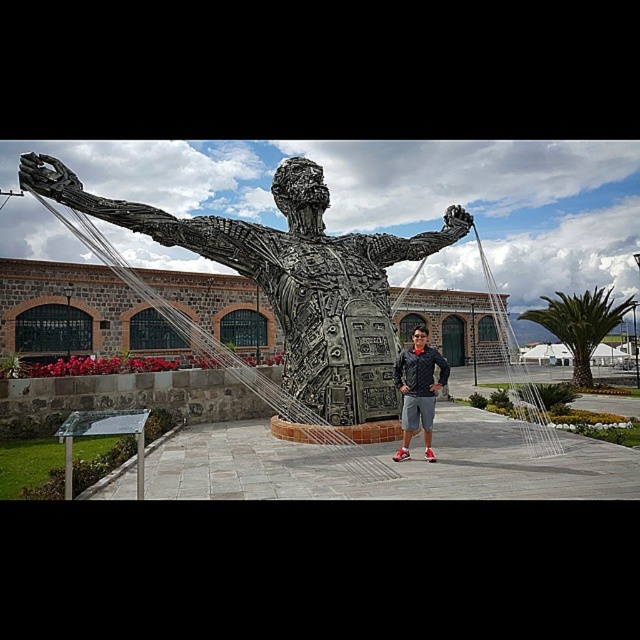
How much distance is there between shiny metallic statue at center and matte black jacket at center?

They are 22.60 feet apart.

Is shiny metallic statue at center bigger than matte black jacket at center?

Actually, shiny metallic statue at center might be smaller than matte black jacket at center.

At what (x,y) coordinates should I click in order to perform the action: click on shiny metallic statue at center. Please return your answer as a coordinate pair (x, y). This screenshot has width=640, height=640. Looking at the image, I should click on (291, 280).

At what (x,y) coordinates should I click in order to perform the action: click on shiny metallic statue at center. Please return your answer as a coordinate pair (x, y). Looking at the image, I should click on (291, 280).

Between metallic wire at center and matte black jacket at center, which one appears on the right side from the viewer's perspective?

metallic wire at center

Is metallic wire at center smaller than matte black jacket at center?

Actually, metallic wire at center might be larger than matte black jacket at center.

Is point (561, 449) positioned after point (406, 451)?

Yes, point (561, 449) is behind point (406, 451).

You are a GUI agent. You are given a task and a screenshot of the screen. Output one action in this format:
    pyautogui.click(x=<x>, y=<y>)
    Task: Click on the metallic wire at center
    The image size is (640, 640).
    Given the screenshot: What is the action you would take?
    pyautogui.click(x=518, y=374)

Find the location of a particular element. The height and width of the screenshot is (640, 640). shiny metallic statue at center is located at coordinates (291, 280).